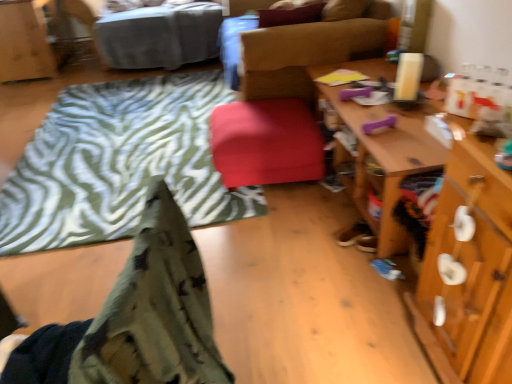
Question: Is wooden cabinet at upper left positioned with its back to matte red stool at center?

Choices:
 (A) no
 (B) yes

Answer: (A)

Question: Is wooden cabinet at upper left in front of matte red stool at center?

Choices:
 (A) yes
 (B) no

Answer: (B)

Question: Is wooden cabinet at upper left next to matte red stool at center and touching it?

Choices:
 (A) no
 (B) yes

Answer: (A)

Question: Considering the relative sizes of wooden cabinet at upper left and matte red stool at center in the image provided, is wooden cabinet at upper left smaller than matte red stool at center?

Choices:
 (A) yes
 (B) no

Answer: (B)

Question: From the image's perspective, does wooden cabinet at upper left appear higher than matte red stool at center?

Choices:
 (A) yes
 (B) no

Answer: (A)

Question: Relative to wooden cabinet at upper left, is velvet-like brown chair at center in front or behind?

Choices:
 (A) behind
 (B) front

Answer: (B)

Question: In the image, is velvet-like brown chair at center on the left side or the right side of wooden cabinet at upper left?

Choices:
 (A) right
 (B) left

Answer: (A)

Question: From the image's perspective, is velvet-like brown chair at center located above or below wooden cabinet at upper left?

Choices:
 (A) below
 (B) above

Answer: (A)

Question: From a real-world perspective, relative to wooden cabinet at upper left, is velvet-like brown chair at center vertically above or below?

Choices:
 (A) above
 (B) below

Answer: (A)

Question: From their relative heights in the image, would you say velvet-like brown chair at center is taller or shorter than gray fabric bed at upper left?

Choices:
 (A) tall
 (B) short

Answer: (A)

Question: Is point (252, 81) closer or farther from the camera than point (124, 62)?

Choices:
 (A) farther
 (B) closer

Answer: (B)

Question: Choose the correct answer: Is velvet-like brown chair at center inside gray fabric bed at upper left or outside it?

Choices:
 (A) outside
 (B) inside

Answer: (A)

Question: Considering the positions of velvet-like brown chair at center and gray fabric bed at upper left in the image, is velvet-like brown chair at center bigger or smaller than gray fabric bed at upper left?

Choices:
 (A) big
 (B) small

Answer: (A)

Question: In terms of height, does soft green fleece blanket at lower left, positioned as the 1th blanket in front-to-back order, look taller or shorter compared to velvet-like brown chair at center?

Choices:
 (A) tall
 (B) short

Answer: (A)

Question: Would you say soft green fleece blanket at lower left, the 2th blanket viewed from the back, is inside or outside velvet-like brown chair at center?

Choices:
 (A) inside
 (B) outside

Answer: (B)